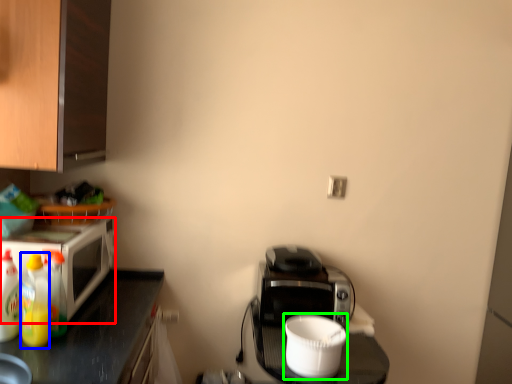
Question: Based on their relative distances, which object is farther from microwave oven (highlighted by a red box)? Choose from bottle (highlighted by a blue box) and appliance (highlighted by a green box).

Choices:
 (A) bottle
 (B) appliance

Answer: (B)